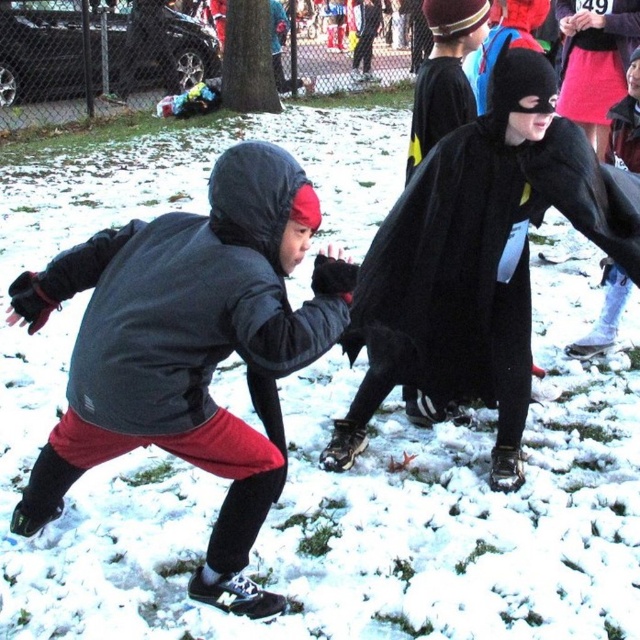
What do you see at coordinates (189, 349) in the screenshot?
I see `matte black jacket at left` at bounding box center [189, 349].

Looking at this image, does matte black jacket at left have a lesser height compared to black matte cape at center?

Indeed, matte black jacket at left has a lesser height compared to black matte cape at center.

This screenshot has height=640, width=640. I want to click on matte black jacket at left, so click(x=189, y=349).